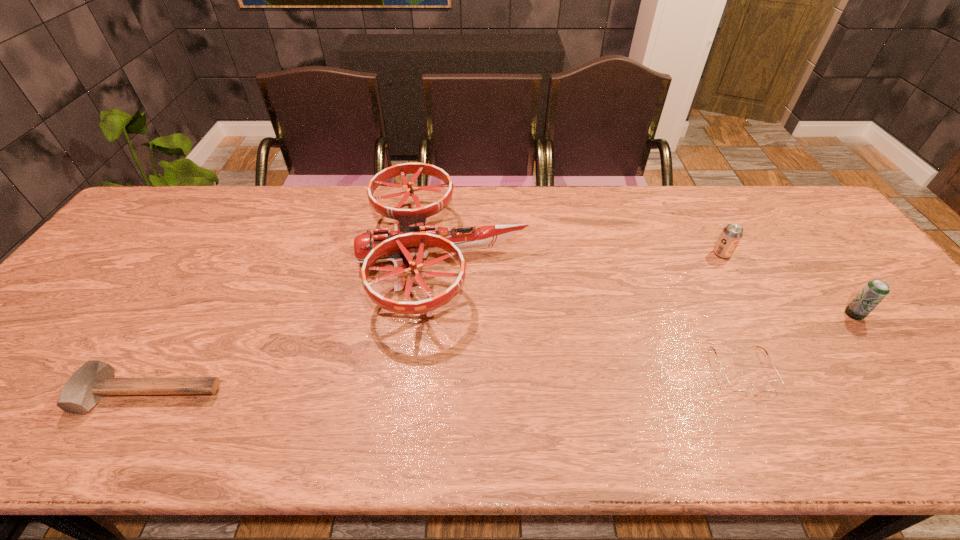
Find the location of a particular element. vacant region at the far left corner of the desktop is located at coordinates (159, 213).

The width and height of the screenshot is (960, 540). In order to click on vacant space at the near left corner in this screenshot , I will do `click(17, 428)`.

In the image, there is a desktop. Identify the location of free space at the far right corner. (775, 205).

Identify the location of unoccupied area between the leftmost object and the tallest object. The height and width of the screenshot is (540, 960). (297, 325).

Where is `vacant region between the right beer can and the mallet`? vacant region between the right beer can and the mallet is located at coordinates [x=502, y=354].

Where is `free space between the nearer beer can and the mallet`? The image size is (960, 540). free space between the nearer beer can and the mallet is located at coordinates (502, 354).

In order to click on free point between the left beer can and the right beer can in this screenshot , I will do `click(788, 284)`.

This screenshot has width=960, height=540. Find the location of `empty space between the farther beer can and the leftmost object`. empty space between the farther beer can and the leftmost object is located at coordinates (436, 323).

Locate an element on the screen. The image size is (960, 540). free point between the leftmost object and the second object from right to left is located at coordinates pyautogui.click(x=436, y=323).

Image resolution: width=960 pixels, height=540 pixels. In order to click on vacant space that's between the leftmost object and the spectacles in this screenshot , I will do `click(446, 381)`.